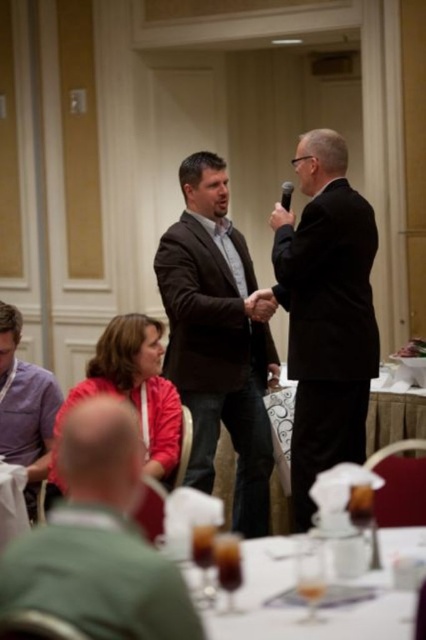
Is matte brown suit at center below purple cotton shirt at lower left?

Actually, matte brown suit at center is above purple cotton shirt at lower left.

Is matte brown suit at center further to camera compared to purple cotton shirt at lower left?

Yes, matte brown suit at center is further from the viewer.

Does point (218, 362) come closer to viewer compared to point (28, 381)?

No, it is not.

The width and height of the screenshot is (426, 640). I want to click on matte brown suit at center, so click(x=218, y=339).

Does green fabric shirt at lower left appear over black plastic microphone at upper center?

No.

Is green fabric shirt at lower left closer to camera compared to black plastic microphone at upper center?

Yes, it is.

Which is in front, point (138, 496) or point (285, 195)?

Point (138, 496) is more forward.

This screenshot has height=640, width=426. I want to click on green fabric shirt at lower left, so click(x=98, y=540).

Who is more distant from viewer, (x=198, y=428) or (x=319, y=232)?

The point (x=198, y=428) is behind.

Who is more forward, (221, 419) or (354, 390)?

Point (354, 390)

Image resolution: width=426 pixels, height=640 pixels. Identify the location of matte brown suit at center. (218, 339).